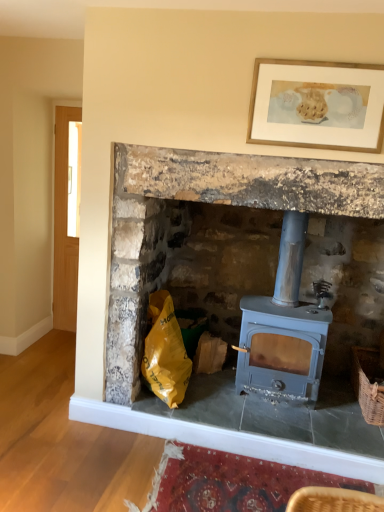
Question: Would you say woven brown basket at lower right is a long distance from wooden-framed artwork at upper center?

Choices:
 (A) yes
 (B) no

Answer: (A)

Question: Does woven brown basket at lower right appear on the right side of wooden-framed artwork at upper center?

Choices:
 (A) yes
 (B) no

Answer: (A)

Question: Is the position of woven brown basket at lower right less distant than that of wooden-framed artwork at upper center?

Choices:
 (A) yes
 (B) no

Answer: (B)

Question: Does woven brown basket at lower right have a greater height compared to wooden-framed artwork at upper center?

Choices:
 (A) no
 (B) yes

Answer: (A)

Question: Is woven brown basket at lower right behind wooden-framed artwork at upper center?

Choices:
 (A) yes
 (B) no

Answer: (A)

Question: From a real-world perspective, is woven brown basket at lower right physically below wooden-framed artwork at upper center?

Choices:
 (A) yes
 (B) no

Answer: (A)

Question: Does woven brown basket at lower right have a larger size compared to matte gray wood stove at center?

Choices:
 (A) no
 (B) yes

Answer: (A)

Question: From a real-world perspective, is woven brown basket at lower right physically below matte gray wood stove at center?

Choices:
 (A) yes
 (B) no

Answer: (A)

Question: Is woven brown basket at lower right thinner than matte gray wood stove at center?

Choices:
 (A) no
 (B) yes

Answer: (B)

Question: Is woven brown basket at lower right shorter than matte gray wood stove at center?

Choices:
 (A) yes
 (B) no

Answer: (A)

Question: Is woven brown basket at lower right in contact with matte gray wood stove at center?

Choices:
 (A) no
 (B) yes

Answer: (A)

Question: From the image's perspective, is woven brown basket at lower right beneath matte gray wood stove at center?

Choices:
 (A) no
 (B) yes

Answer: (B)

Question: Are matte blue wood burning stove at center and wooden-framed artwork at upper center beside each other?

Choices:
 (A) yes
 (B) no

Answer: (B)